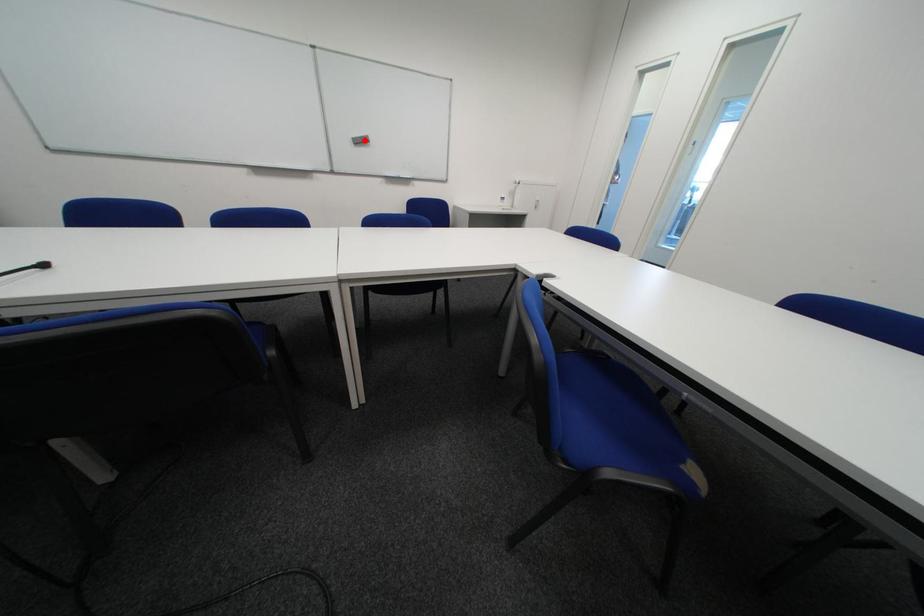
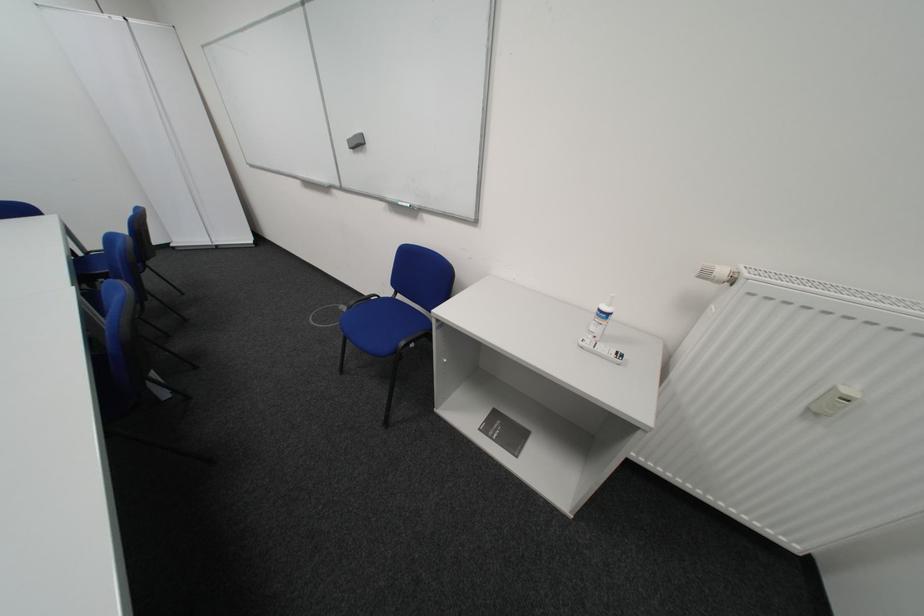
Question: A red point is marked in image1. In image2, is the corresponding 3D point closer to the camera or farther? Reply with the corresponding letter.

Choices:
 (A) The corresponding 3D point is closer.
 (B) The corresponding 3D point is farther.

Answer: (B)